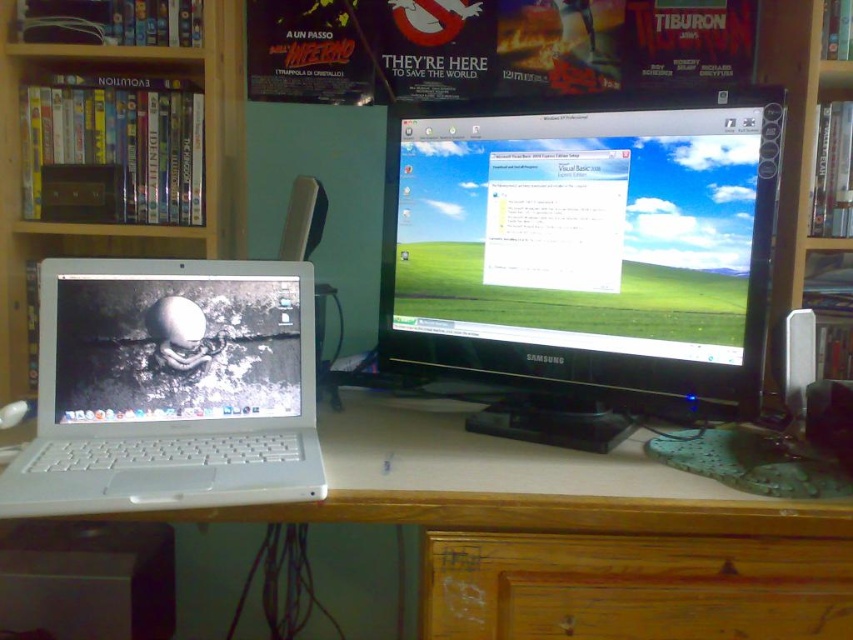
Question: Which object appears closest to the camera in this image?

Choices:
 (A) black glossy monitor at center
 (B) white plastic laptop at left
 (C) wooden bookshelf at upper left
 (D) wooden drawer at lower center

Answer: (B)

Question: Which point is farther to the camera?

Choices:
 (A) wooden drawer at lower center
 (B) wooden bookcase at right
 (C) wooden bookshelf at upper left

Answer: (C)

Question: Is black glossy monitor at center thinner than white glossy laptop at left?

Choices:
 (A) no
 (B) yes

Answer: (A)

Question: Is black glossy monitor at center closer to camera compared to white plastic laptop at left?

Choices:
 (A) no
 (B) yes

Answer: (A)

Question: Which of the following is the farthest from the observer?

Choices:
 (A) (611, 538)
 (B) (788, 54)

Answer: (B)

Question: Can you confirm if wooden drawer at lower center is positioned to the right of wooden bookcase at right?

Choices:
 (A) yes
 (B) no

Answer: (B)